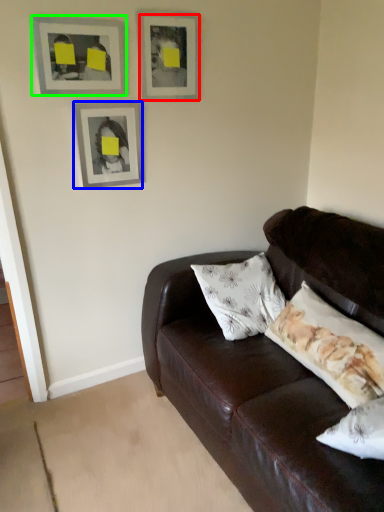
Question: Considering the real-world distances, which object is farthest from picture frame (highlighted by a red box)? picture frame (highlighted by a blue box) or picture frame (highlighted by a green box)?

Choices:
 (A) picture frame
 (B) picture frame

Answer: (A)